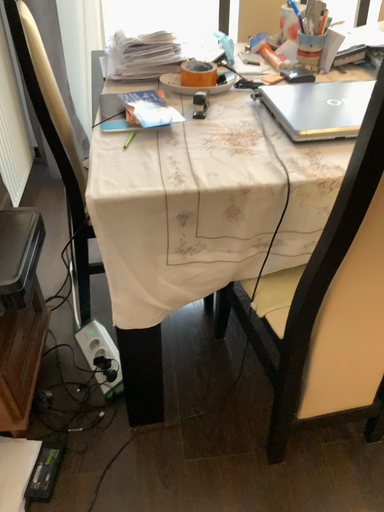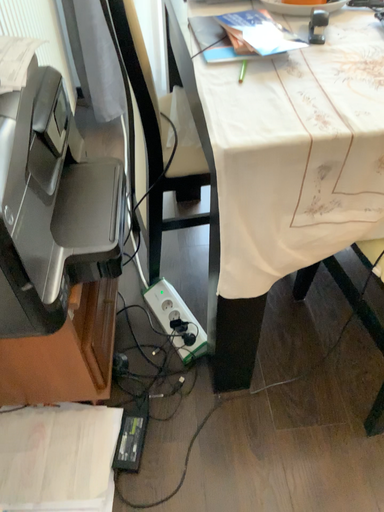
Question: Which way did the camera rotate in the video?

Choices:
 (A) rotated downward
 (B) rotated upward

Answer: (A)